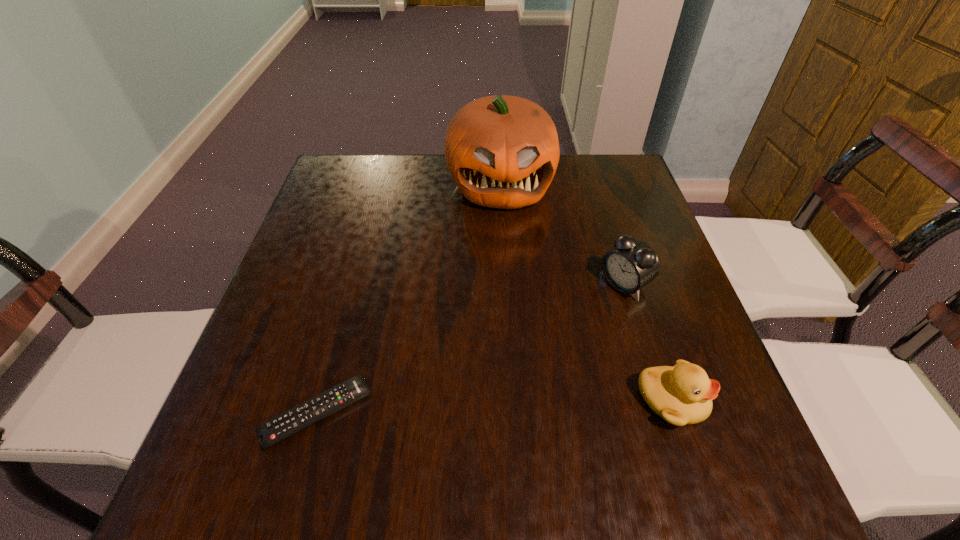
The image size is (960, 540). In order to click on remote control in this screenshot , I will do `click(271, 432)`.

The height and width of the screenshot is (540, 960). I want to click on the leftmost object, so click(271, 432).

The image size is (960, 540). I want to click on duckling, so click(x=682, y=395).

Identify the location of alarm clock. The height and width of the screenshot is (540, 960). (632, 264).

The image size is (960, 540). Find the location of `the third nearest object`. the third nearest object is located at coordinates (632, 264).

Where is `the second object from left to right`? the second object from left to right is located at coordinates (x=502, y=151).

At what (x,y) coordinates should I click in order to perform the action: click on the farthest object. Please return your answer as a coordinate pair (x, y). The width and height of the screenshot is (960, 540). Looking at the image, I should click on (502, 151).

Identify the location of free space located 0.360m on the back of the leftmost object. (362, 251).

Where is `vacant point located on the front side of the alarm clock`? The height and width of the screenshot is (540, 960). vacant point located on the front side of the alarm clock is located at coordinates (585, 315).

Identify the location of vacant region located on the front side of the alarm clock. This screenshot has width=960, height=540. (531, 356).